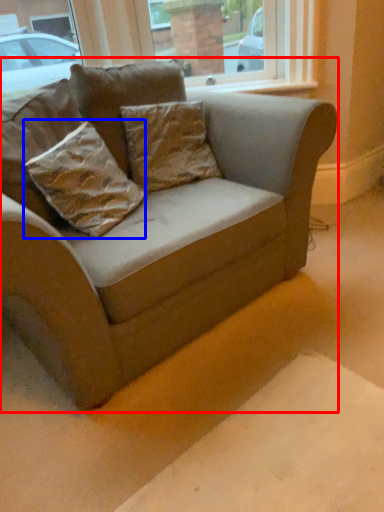
Question: Which of the following is the closest to the observer, studio couch (highlighted by a red box) or pillow (highlighted by a blue box)?

Choices:
 (A) studio couch
 (B) pillow

Answer: (A)